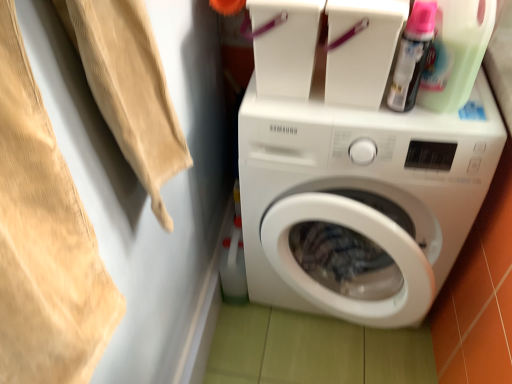
Where is `empty space that is to the right of translucent plastic spray can at upper right, which is counted as the first cleaning product, starting from the left`? The image size is (512, 384). empty space that is to the right of translucent plastic spray can at upper right, which is counted as the first cleaning product, starting from the left is located at coordinates (464, 113).